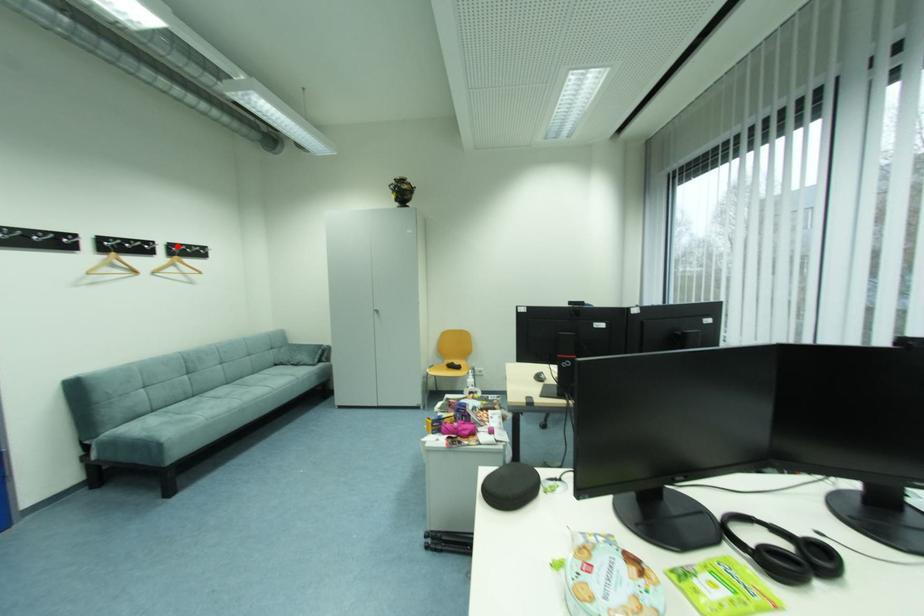
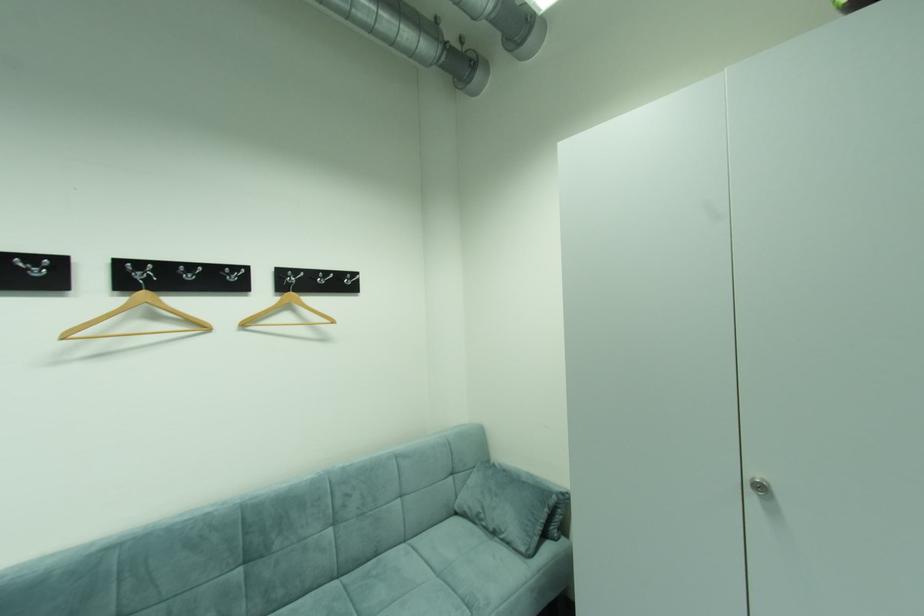
The point at the highlighted location is marked in the first image. Where is the corresponding point in the second image?

(286, 274)